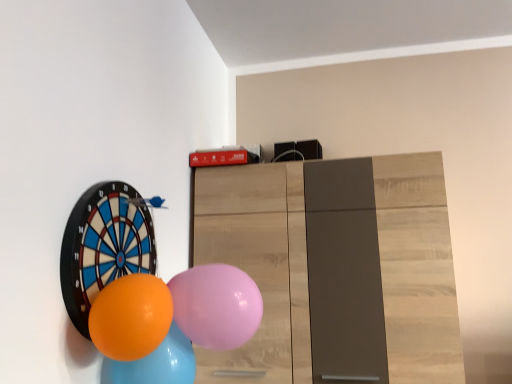
Question: Is orange rubber balloon at left, the 1th balloon in the left-to-right sequence, outside of orange glossy balloon at lower left, the 3th balloon viewed from the left?

Choices:
 (A) yes
 (B) no

Answer: (A)

Question: Is orange glossy balloon at lower left, which is the 2th balloon in right-to-left order, a part of orange rubber balloon at left, the fourth balloon from the right?

Choices:
 (A) yes
 (B) no

Answer: (B)

Question: Considering the relative sizes of orange rubber balloon at left, the fourth balloon from the right, and orange glossy balloon at lower left, which is the 2th balloon in right-to-left order, in the image provided, is orange rubber balloon at left, the fourth balloon from the right, taller than orange glossy balloon at lower left, which is the 2th balloon in right-to-left order,?

Choices:
 (A) no
 (B) yes

Answer: (B)

Question: Is orange rubber balloon at left, the fourth balloon from the right, at the right side of orange glossy balloon at lower left, the 3th balloon viewed from the left?

Choices:
 (A) no
 (B) yes

Answer: (A)

Question: Can you confirm if orange rubber balloon at left, the fourth balloon from the right, is shorter than orange glossy balloon at lower left, the 3th balloon viewed from the left?

Choices:
 (A) yes
 (B) no

Answer: (B)

Question: Is orange rubber balloon at left, the fourth balloon from the right, aimed at orange glossy balloon at lower left, which is the 2th balloon in right-to-left order?

Choices:
 (A) yes
 (B) no

Answer: (A)

Question: Would you say pink rubber balloon at center, the fourth balloon viewed from the left, is outside orange rubber balloon at left, the fourth balloon from the right?

Choices:
 (A) no
 (B) yes

Answer: (B)

Question: Considering the relative positions of pink rubber balloon at center, the fourth balloon viewed from the left, and orange rubber balloon at left, the fourth balloon from the right, in the image provided, is pink rubber balloon at center, the fourth balloon viewed from the left, to the left of orange rubber balloon at left, the fourth balloon from the right, from the viewer's perspective?

Choices:
 (A) yes
 (B) no

Answer: (B)

Question: From the image's perspective, is pink rubber balloon at center, the fourth balloon viewed from the left, on orange rubber balloon at left, the fourth balloon from the right?

Choices:
 (A) yes
 (B) no

Answer: (B)

Question: Can you confirm if pink rubber balloon at center, the fourth balloon viewed from the left, is smaller than orange rubber balloon at left, the fourth balloon from the right?

Choices:
 (A) yes
 (B) no

Answer: (B)

Question: Are pink rubber balloon at center, the fourth balloon viewed from the left, and orange rubber balloon at left, the 1th balloon in the left-to-right sequence, located far from each other?

Choices:
 (A) yes
 (B) no

Answer: (B)

Question: Does pink rubber balloon at center, the fourth balloon viewed from the left, appear on the right side of orange rubber balloon at left, the fourth balloon from the right?

Choices:
 (A) no
 (B) yes

Answer: (B)

Question: Are orange glossy balloon at lower left, which is the 2th balloon in right-to-left order, and pink rubber balloon at center, which is the 1th balloon in right-to-left order, far apart?

Choices:
 (A) no
 (B) yes

Answer: (A)